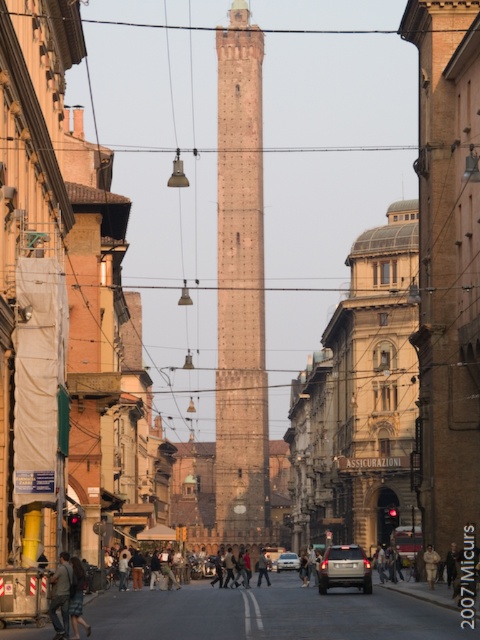
Which is below, silver metallic car at center or satin silver sedan at center?

Positioned lower is satin silver sedan at center.

Is point (321, 586) positioned after point (295, 563)?

No, it is not.

Is point (342, 561) closer to viewer compared to point (285, 566)?

Yes, it is in front of point (285, 566).

At what (x,y) coordinates should I click in order to perform the action: click on silver metallic car at center. Please return your answer as a coordinate pair (x, y). This screenshot has width=480, height=640. Looking at the image, I should click on (345, 568).

Is point (68, 596) in front of point (427, 579)?

Yes, it is in front of point (427, 579).

You are a GUI agent. You are given a task and a screenshot of the screen. Output one action in this format:
    pyautogui.click(x=<x>, y=<y>)
    Task: Click on the denim jacket at lower left
    
    Given the screenshot: What is the action you would take?
    pyautogui.click(x=60, y=596)

Which is more to the right, denim jacket at lower left or dark brown leather jacket at center?

Positioned to the right is dark brown leather jacket at center.

What do you see at coordinates (60, 596) in the screenshot? This screenshot has width=480, height=640. I see `denim jacket at lower left` at bounding box center [60, 596].

Where is `denim jacket at lower left`? denim jacket at lower left is located at coordinates (60, 596).

Where is `denim jacket at lower left`? denim jacket at lower left is located at coordinates 60,596.